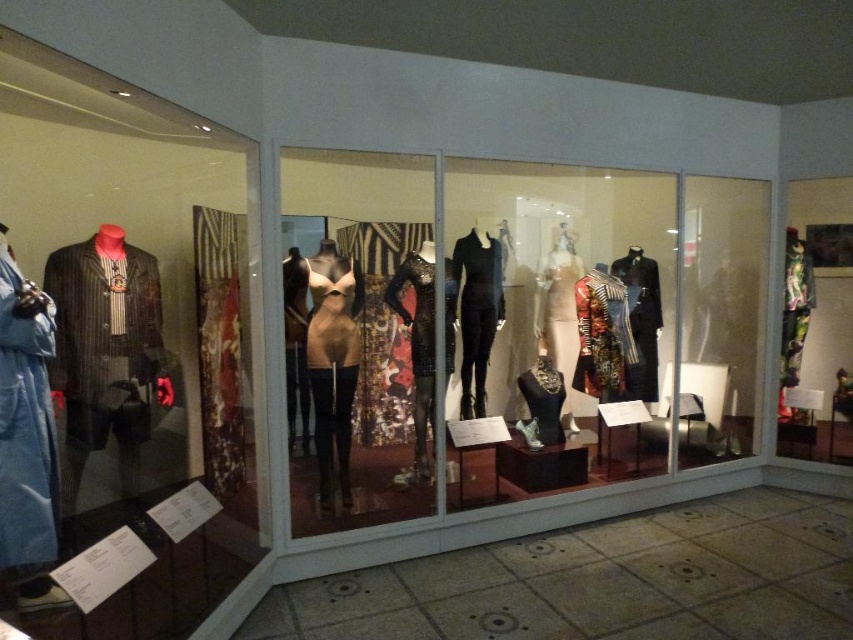
Is shiny metallic dress form at center above matte beige dress at center?

Indeed, shiny metallic dress form at center is positioned over matte beige dress at center.

Can you confirm if shiny metallic dress form at center is positioned below matte beige dress at center?

Incorrect, shiny metallic dress form at center is not positioned below matte beige dress at center.

Does point (578, 234) come behind point (567, 257)?

Yes, it is behind point (567, 257).

Identify the location of shiny metallic dress form at center. (520, 326).

Can you confirm if striped fabric blazer at left is positioned below matte beige top at center?

Actually, striped fabric blazer at left is above matte beige top at center.

Is striped fabric blazer at left taller than matte beige top at center?

Incorrect, striped fabric blazer at left's height is not larger of matte beige top at center's.

At what (x,y) coordinates should I click in order to perform the action: click on striped fabric blazer at left. Please return your answer as a coordinate pair (x, y). The image size is (853, 640). Looking at the image, I should click on (106, 339).

Can you confirm if shiny black dress at center is positioned below matte beige dress at center?

Indeed, shiny black dress at center is positioned under matte beige dress at center.

Does shiny black dress at center have a smaller size compared to matte beige dress at center?

Actually, shiny black dress at center might be larger than matte beige dress at center.

Does point (428, 344) come closer to viewer compared to point (567, 266)?

Yes.

Where is `shiny black dress at center`? shiny black dress at center is located at coordinates [418, 348].